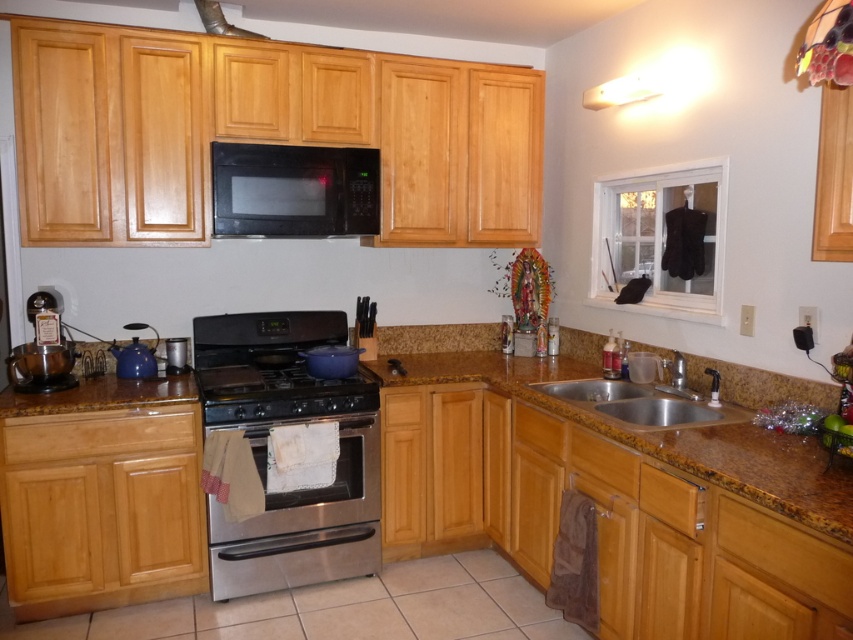
Question: Is black matte microwave at upper center thinner than stainless steel stove at center?

Choices:
 (A) no
 (B) yes

Answer: (B)

Question: Can you confirm if brown granite countertop at center is thinner than black matte microwave at upper center?

Choices:
 (A) no
 (B) yes

Answer: (A)

Question: Which object appears closest to the camera in this image?

Choices:
 (A) stainless steel sink at lower right
 (B) metallic silver exhaust hood at upper center
 (C) stainless steel stove at center

Answer: (A)

Question: Which point is farther from the camera taking this photo?

Choices:
 (A) (349, 147)
 (B) (631, 420)
 (C) (242, 28)
 (D) (697, 472)

Answer: (C)

Question: From the image, what is the correct spatial relationship of brown granite countertop at center in relation to black matte microwave at upper center?

Choices:
 (A) right
 (B) left

Answer: (A)

Question: Among these points, which one is nearest to the camera?

Choices:
 (A) (790, 499)
 (B) (242, 548)

Answer: (A)